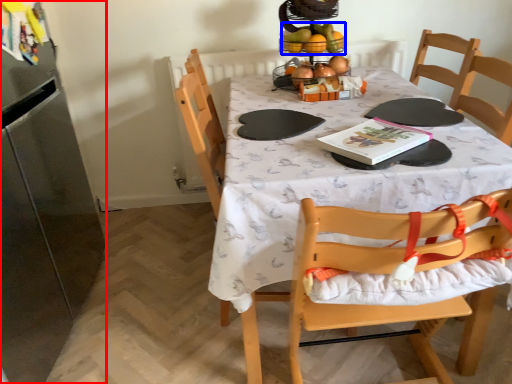
Question: Among these objects, which one is farthest to the camera, appliance (highlighted by a red box) or fruit (highlighted by a blue box)?

Choices:
 (A) appliance
 (B) fruit

Answer: (B)